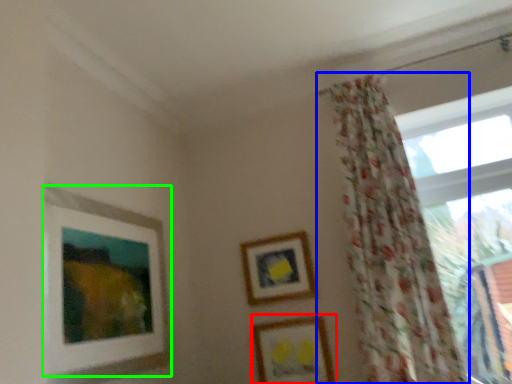
Question: Considering the real-world distances, which object is closest to picture frame (highlighted by a red box)? curtain (highlighted by a blue box) or picture frame (highlighted by a green box).

Choices:
 (A) curtain
 (B) picture frame

Answer: (A)